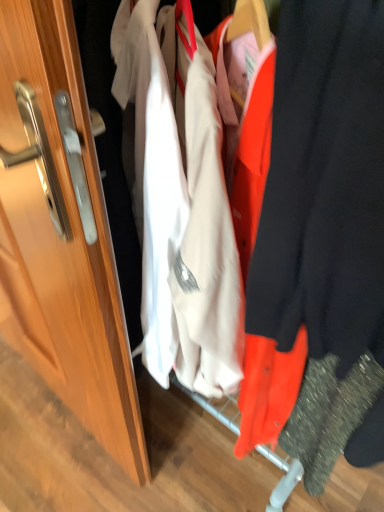
This screenshot has width=384, height=512. Describe the element at coordinates (62, 242) in the screenshot. I see `wooden door at left` at that location.

Where is `wooden door at left`? This screenshot has width=384, height=512. wooden door at left is located at coordinates (62, 242).

Locate an element on the screen. The height and width of the screenshot is (512, 384). wooden door at left is located at coordinates (62, 242).